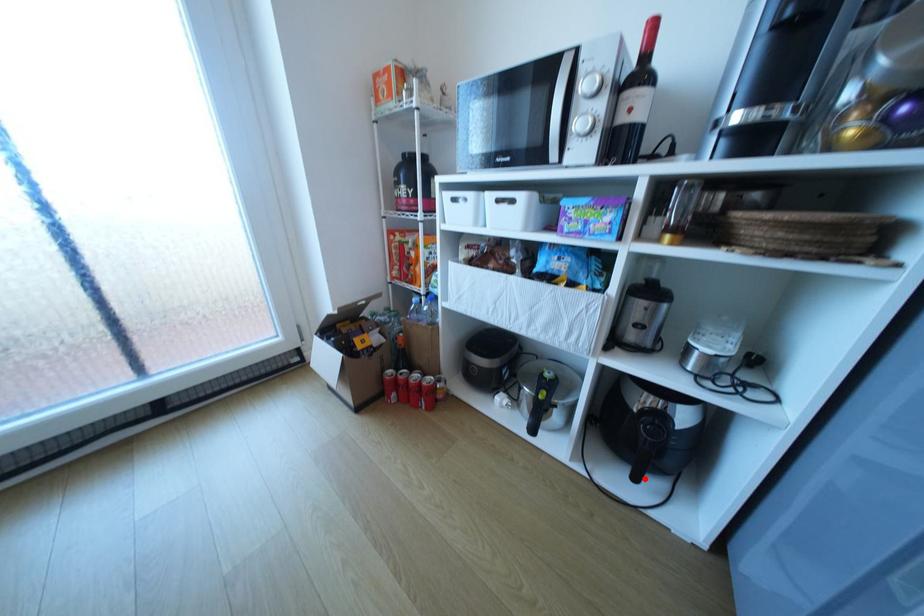
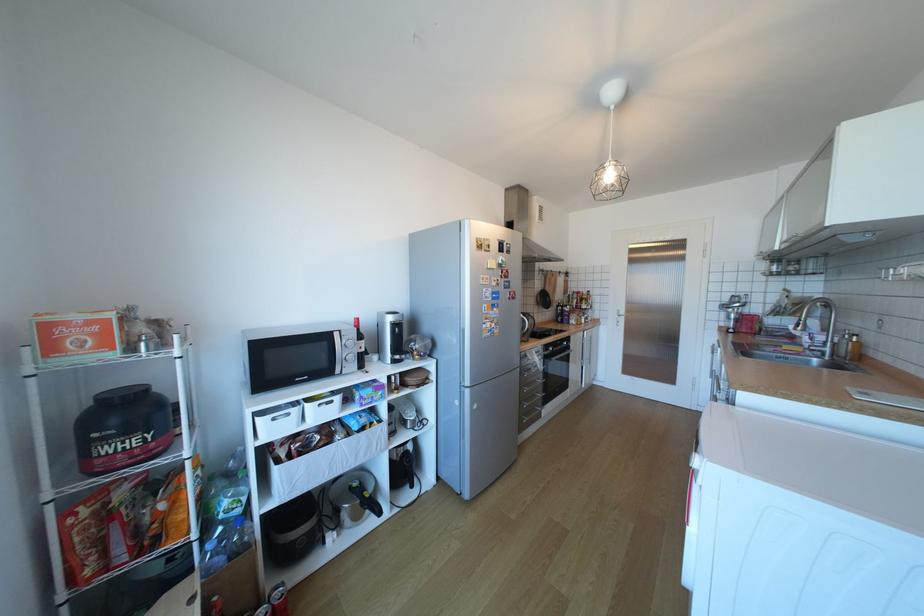
Question: I am providing you with two images of the same scene from different viewpoints. A red point is shown in image1. For the corresponding object point in image2, is it positioned nearer or farther from the camera?

Choices:
 (A) Nearer
 (B) Farther

Answer: (B)